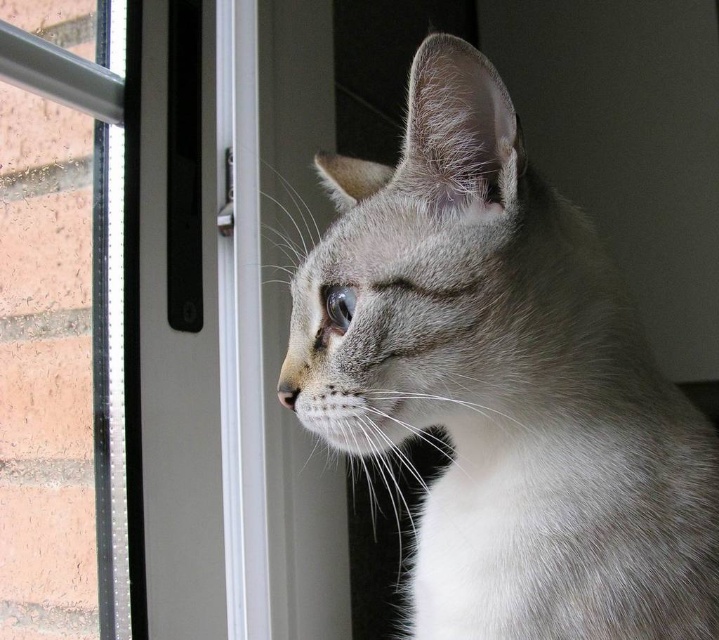
Does gray fur cat at center lie in front of clear plastic screen door at center?

Yes.

The image size is (719, 640). What do you see at coordinates (503, 381) in the screenshot?
I see `gray fur cat at center` at bounding box center [503, 381].

I want to click on gray fur cat at center, so click(x=503, y=381).